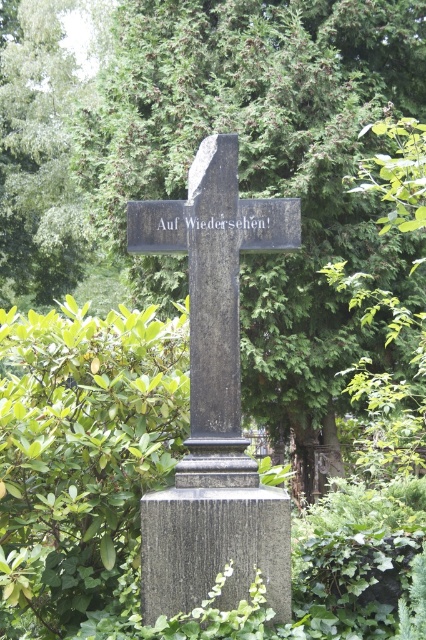
Question: Which object is the closest to the granite gravestone at center?

Choices:
 (A) green leafy tree at center
 (B) green leafy bush at center
 (C) black stone cross at center

Answer: (C)

Question: Does black stone cross at center have a greater width compared to granite gravestone at center?

Choices:
 (A) yes
 (B) no

Answer: (A)

Question: Can you confirm if green leafy bush at center is bigger than granite gravestone at center?

Choices:
 (A) yes
 (B) no

Answer: (A)

Question: Does green leafy tree at center appear on the left side of granite gravestone at center?

Choices:
 (A) yes
 (B) no

Answer: (B)

Question: Which of the following is the closest to the observer?

Choices:
 (A) (199, 348)
 (B) (279, 332)

Answer: (A)

Question: Which object appears closest to the camera in this image?

Choices:
 (A) granite gravestone at center
 (B) green leafy bush at center

Answer: (B)